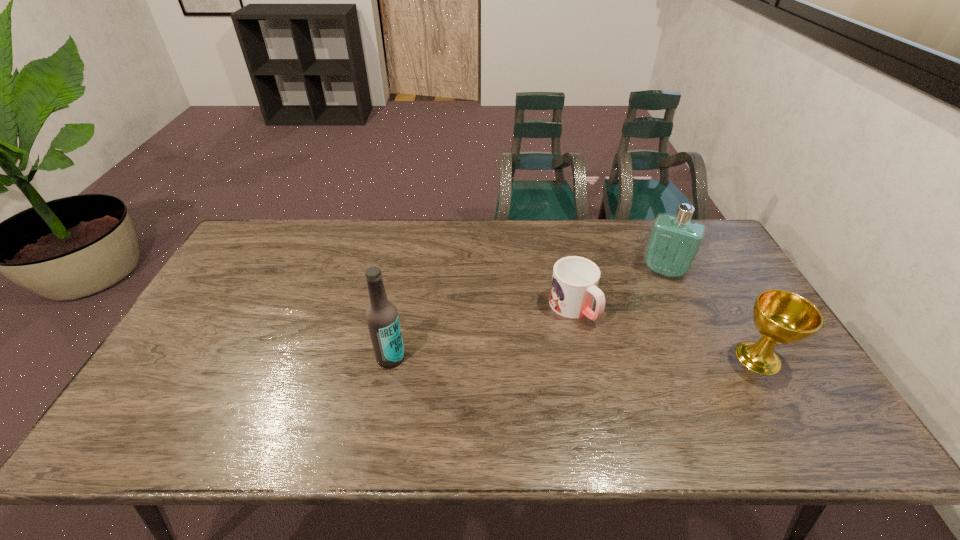
At what (x,y) coordinates should I click in order to perform the action: click on free space between the shortest object and the leftmost object. Please return your answer as a coordinate pair (x, y). The height and width of the screenshot is (540, 960). Looking at the image, I should click on (482, 333).

Find the location of a particular element. The height and width of the screenshot is (540, 960). free space that is in between the second shortest object and the beer bottle is located at coordinates (574, 357).

Where is `vacant space that's between the farthest object and the shortest object`? vacant space that's between the farthest object and the shortest object is located at coordinates (618, 289).

Identify the location of vacant space that's between the third tallest object and the perfume. [711, 314].

This screenshot has width=960, height=540. What are the coordinates of `free area in between the third nearest object and the third tallest object` in the screenshot? It's located at (665, 333).

Where is `vacant point located between the third nearest object and the perfume`? vacant point located between the third nearest object and the perfume is located at coordinates (618, 289).

You are a GUI agent. You are given a task and a screenshot of the screen. Output one action in this format:
    pyautogui.click(x=<x>, y=<y>)
    Task: Click on the free spot between the mug and the beer bottle
    The image size is (960, 540).
    Given the screenshot: What is the action you would take?
    pyautogui.click(x=482, y=333)

I want to click on object identified as the third closest to the shortest object, so click(382, 318).

Locate which object is the third closest to the third nearest object. Please provide its 2D coordinates. Your answer should be formatted as a tuple, i.e. [(x, y)], where the tuple contains the x and y coordinates of a point satisfying the conditions above.

[(382, 318)]

At what (x,y) coordinates should I click in order to perform the action: click on vacant position in the image that satisfies the following two spatial constraints: 1. on the side of the second shortest object with the label; 2. on the right side of the leftmost object. Please return your answer as a coordinate pair (x, y). Looking at the image, I should click on (391, 357).